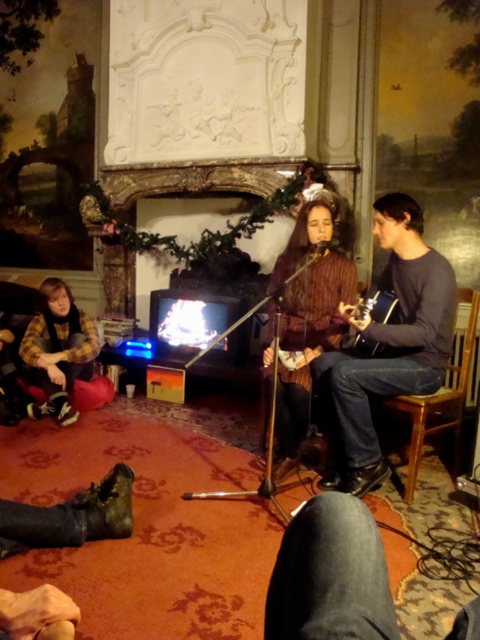
You are organizing a charity event and need to decide which sweater to display on a mannequin. Both the brown textured sweater at center and the striped sweater at center are available. Based on their sizes, which one would be more suitable for a mannequin that requires a taller garment?

The striped sweater at center is taller than the brown textured sweater at center, so it would be more suitable for the mannequin that requires a taller garment.

You are standing in the room and want to place a small decorative item on one of two specific points on the fireplace mantel. The points are located at coordinates point [352,444] and point [316,330]. Which point is closer to you so the decoration will be more visible?

Point [352,444] is closer to the viewer than point [316,330], so placing the decoration there will make it more visible.